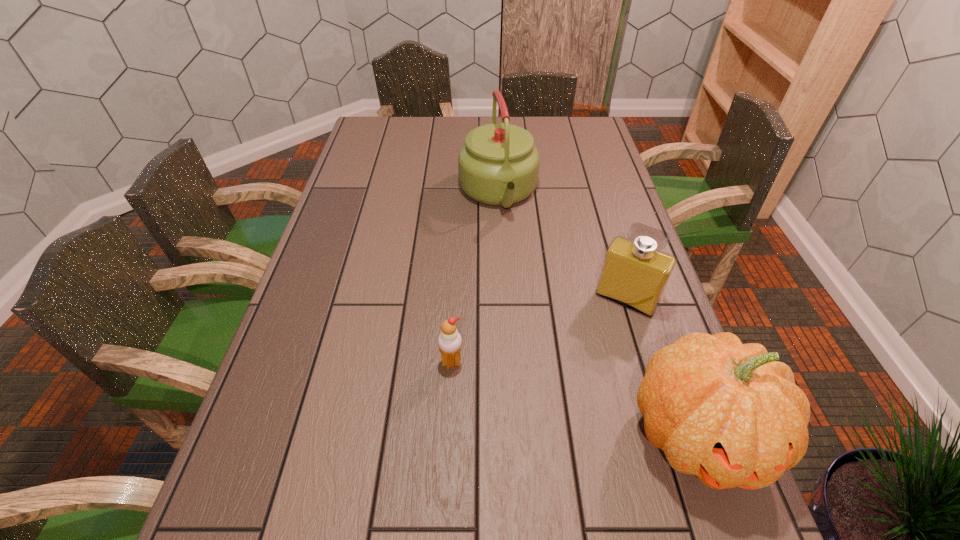
The width and height of the screenshot is (960, 540). Identify the location of the shortest object. (449, 341).

Identify the location of the third farthest object. (449, 341).

Locate an element on the screen. This screenshot has height=540, width=960. pumpkin is located at coordinates (729, 413).

Identify the location of the third tallest object. This screenshot has width=960, height=540. (635, 272).

The image size is (960, 540). Find the location of `perfume`. perfume is located at coordinates (635, 272).

This screenshot has width=960, height=540. I want to click on the farthest object, so click(498, 165).

Where is `vacant area located 0.200m at the front with a straw on the shortest object`? This screenshot has width=960, height=540. vacant area located 0.200m at the front with a straw on the shortest object is located at coordinates (446, 464).

Find the location of a particular element. This screenshot has width=960, height=540. vacant space located on the front-facing side of the second farthest object is located at coordinates (558, 419).

Where is `vacant position located 0.390m on the front-facing side of the second farthest object`? This screenshot has width=960, height=540. vacant position located 0.390m on the front-facing side of the second farthest object is located at coordinates (542, 448).

Where is `vacant space positioned on the front-facing side of the second farthest object`? The height and width of the screenshot is (540, 960). vacant space positioned on the front-facing side of the second farthest object is located at coordinates (602, 338).